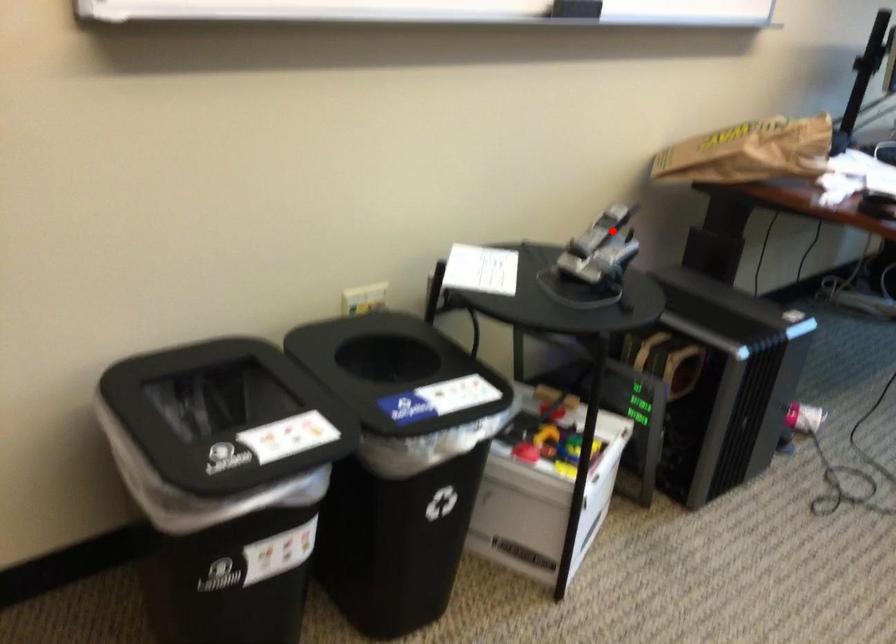
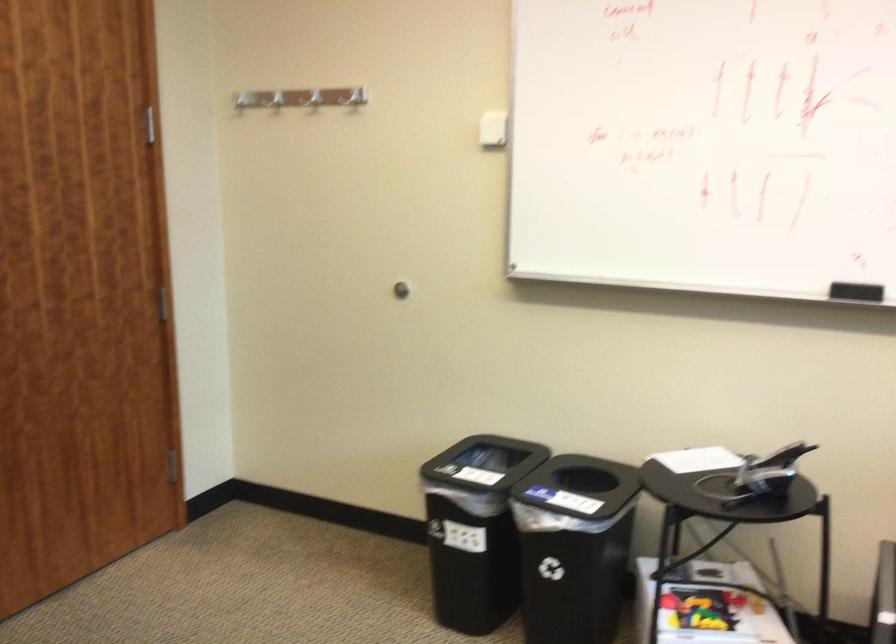
Question: A red point is marked in image1. In image2, is the corresponding 3D point closer to the camera or farther? Reply with the corresponding letter.

Choices:
 (A) The corresponding 3D point is closer.
 (B) The corresponding 3D point is farther.

Answer: (B)